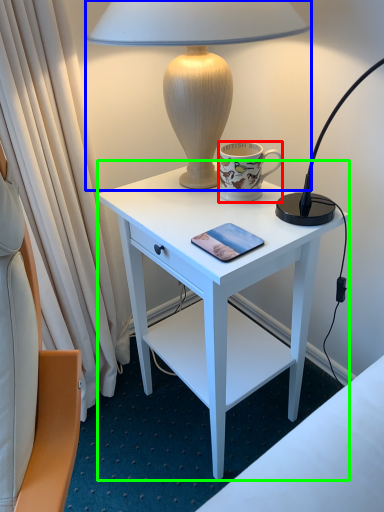
Question: Estimate the real-world distances between objects in this image. Which object is farther from coffee cup (highlighted by a red box), lamp (highlighted by a blue box) or desk (highlighted by a green box)?

Choices:
 (A) lamp
 (B) desk

Answer: (B)